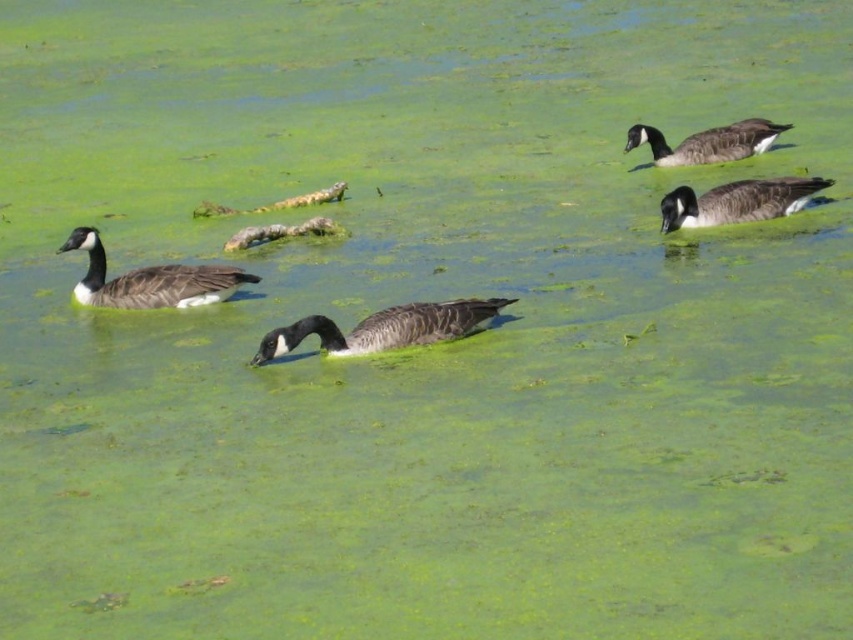
Between point (277, 342) and point (701, 147), which one is positioned in front?

Positioned in front is point (277, 342).

Is point (384, 348) closer to viewer compared to point (728, 134)?

Yes, point (384, 348) is closer to viewer.

You are a GUI agent. You are given a task and a screenshot of the screen. Output one action in this format:
    pyautogui.click(x=<x>, y=<y>)
    Task: Click on the black glossy duck at center
    Image resolution: width=853 pixels, height=640 pixels.
    Given the screenshot: What is the action you would take?
    pyautogui.click(x=384, y=328)

Which is more to the right, black glossy duck at center or dark gray matte duck at right?

Positioned to the right is dark gray matte duck at right.

Between black glossy duck at center and dark gray matte duck at right, which one is positioned lower?

black glossy duck at center is below.

The height and width of the screenshot is (640, 853). Describe the element at coordinates (384, 328) in the screenshot. I see `black glossy duck at center` at that location.

Find the location of a particular element. black glossy duck at center is located at coordinates (384, 328).

Who is lower down, dark gray matte duck at left or dark gray matte duck at right?

dark gray matte duck at left is lower down.

Can you confirm if dark gray matte duck at left is smaller than dark gray matte duck at right?

No, dark gray matte duck at left is not smaller than dark gray matte duck at right.

What do you see at coordinates (149, 280) in the screenshot?
I see `dark gray matte duck at left` at bounding box center [149, 280].

I want to click on dark gray matte duck at left, so click(x=149, y=280).